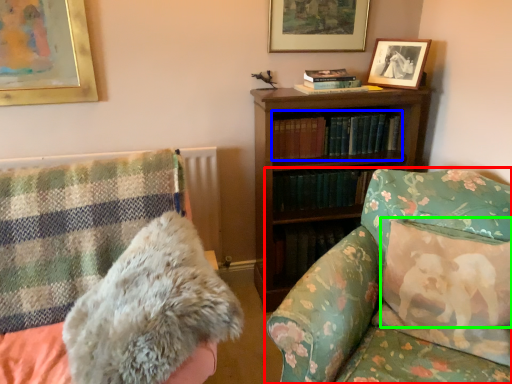
Question: Which is farther away from studio couch (highlighted by a red box)? book (highlighted by a blue box) or pillow (highlighted by a green box)?

Choices:
 (A) book
 (B) pillow

Answer: (A)